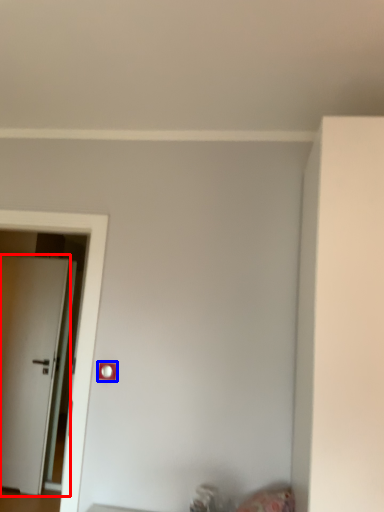
Question: Among these objects, which one is farthest to the camera, door (highlighted by a red box) or light switch (highlighted by a blue box)?

Choices:
 (A) door
 (B) light switch

Answer: (A)